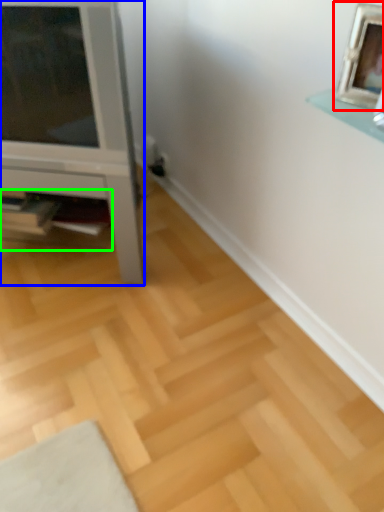
Question: Which object is the closest to the picture frame (highlighted by a red box)? Choose among these: furniture (highlighted by a blue box) or shelf (highlighted by a green box).

Choices:
 (A) furniture
 (B) shelf

Answer: (A)